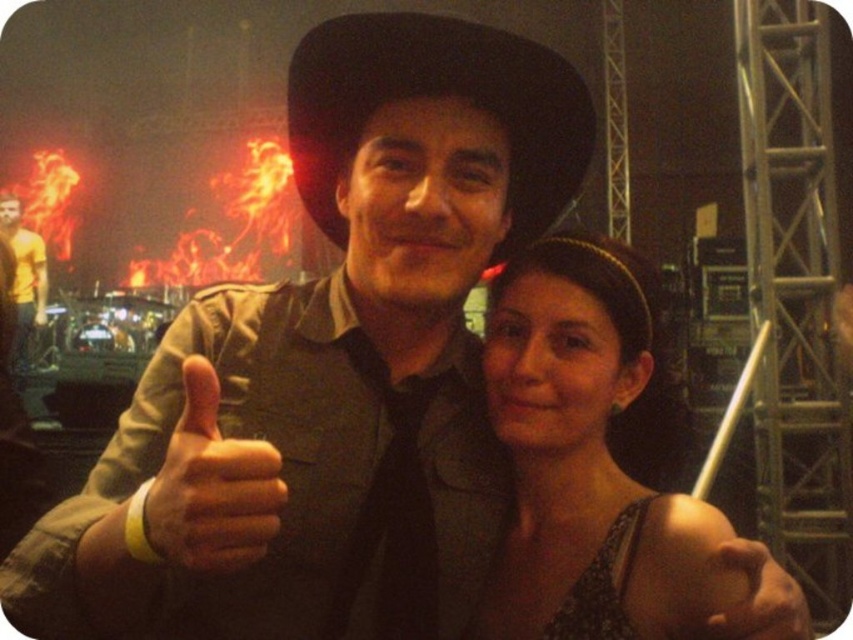
Question: Which of the following is the farthest from the observer?

Choices:
 (A) (10, 237)
 (B) (515, 248)
 (C) (709, 637)
 (D) (665, 508)

Answer: (A)

Question: Is matte black dress at center thinner than smooth skin hand at center?

Choices:
 (A) yes
 (B) no

Answer: (B)

Question: Is matte black hand at center above smooth skin hand at center?

Choices:
 (A) no
 (B) yes

Answer: (B)

Question: Based on their relative distances, which object is nearer to the yellow t-shirt at left?

Choices:
 (A) matte black dress at center
 (B) smooth skin hand at center
 (C) matte black hand at center
 (D) black felt fedora at center

Answer: (A)

Question: Among these points, which one is nearest to the camera?

Choices:
 (A) (33, 236)
 (B) (720, 618)
 (C) (521, 145)

Answer: (B)

Question: Is matte black hand at center below yellow t-shirt at left?

Choices:
 (A) yes
 (B) no

Answer: (A)